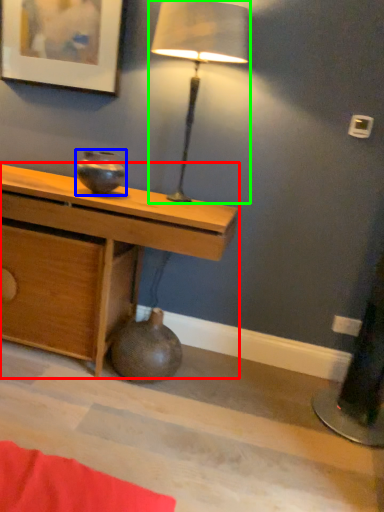
Question: Which object is positioned farthest from desk (highlighted by a red box)? Select from vase (highlighted by a blue box) and lamp (highlighted by a green box).

Choices:
 (A) vase
 (B) lamp

Answer: (B)